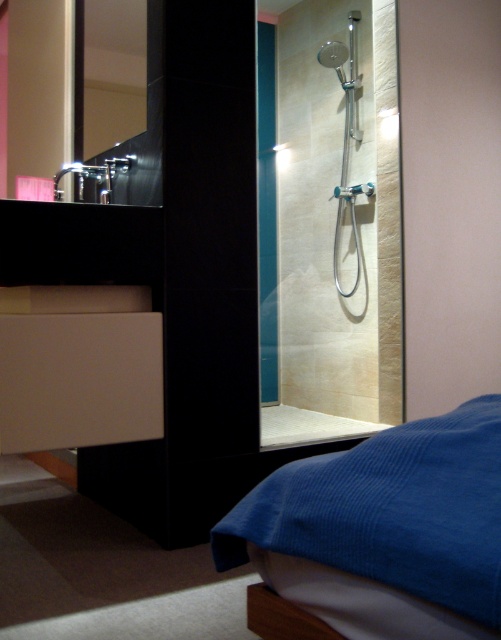
Question: Can you confirm if blue corduroy bed at lower right is smaller than polished chrome faucet at upper left?

Choices:
 (A) no
 (B) yes

Answer: (B)

Question: Does translucent glass shower door at center have a smaller size compared to polished silver mirror at upper left?

Choices:
 (A) no
 (B) yes

Answer: (A)

Question: Estimate the real-world distances between objects in this image. Which object is farther from the translucent glass shower door at center?

Choices:
 (A) polished silver mirror at upper left
 (B) blue corduroy bed at lower right

Answer: (B)

Question: Which object appears closest to the camera in this image?

Choices:
 (A) polished silver mirror at upper left
 (B) translucent glass shower door at center
 (C) polished chrome faucet at upper left
 (D) white matte drawer at lower left

Answer: (D)

Question: Which object is positioned farthest from the white matte drawer at lower left?

Choices:
 (A) blue corduroy bed at lower right
 (B) translucent glass shower door at center
 (C) polished chrome faucet at upper left
 (D) polished silver mirror at upper left

Answer: (C)

Question: Is the position of translucent glass shower door at center less distant than that of blue corduroy bed at lower right?

Choices:
 (A) no
 (B) yes

Answer: (A)